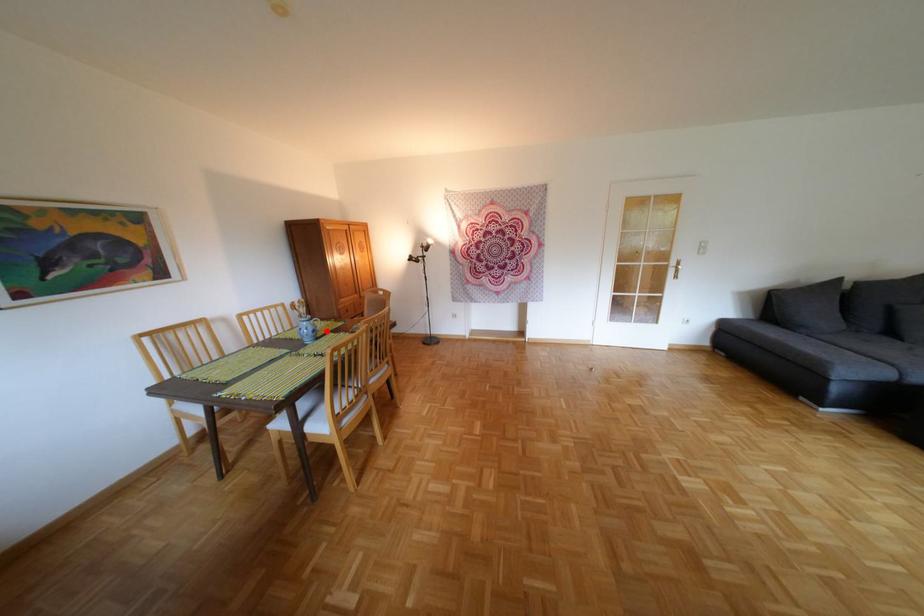
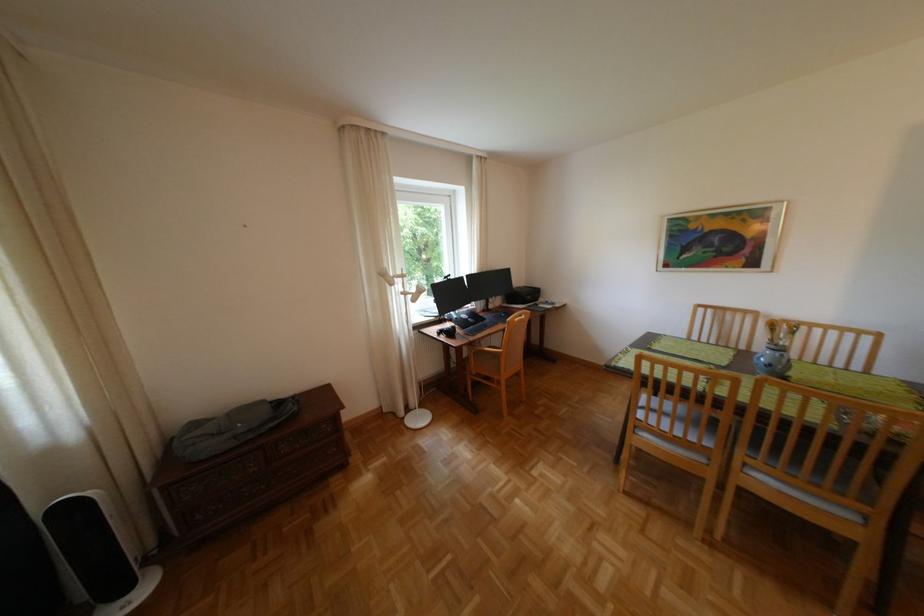
In the second image, find the point that corresponds to the highlighted location in the first image.

(782, 365)